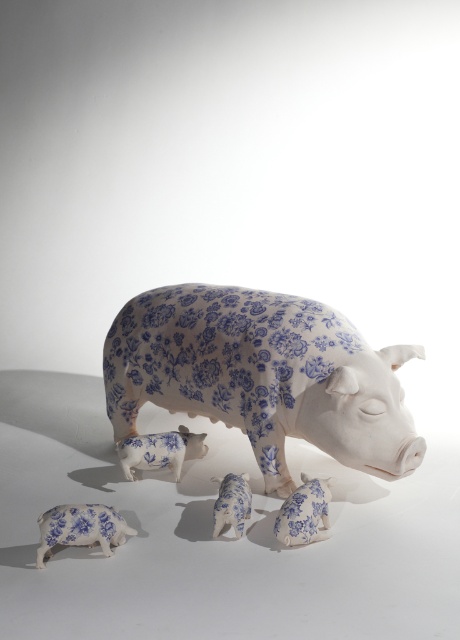
Question: Can you confirm if blue floral-patterned pig at center is positioned above blue and white porcelain piglet at lower center?

Choices:
 (A) no
 (B) yes

Answer: (B)

Question: Is blue and white porcelain piglet at lower left below blue porcelain piglet at center?

Choices:
 (A) no
 (B) yes

Answer: (B)

Question: Which point is farther to the camera?

Choices:
 (A) blue and white porcelain piglet at lower center
 (B) blue porcelain piglet at center

Answer: (B)

Question: Can you confirm if blue floral-patterned pig at center is positioned above blue porcelain piglet at center?

Choices:
 (A) yes
 (B) no

Answer: (A)

Question: Which point is closer to the camera taking this photo?

Choices:
 (A) (326, 512)
 (B) (235, 401)

Answer: (A)

Question: Among these points, which one is nearest to the camera?

Choices:
 (A) (134, 465)
 (B) (207, 408)

Answer: (A)